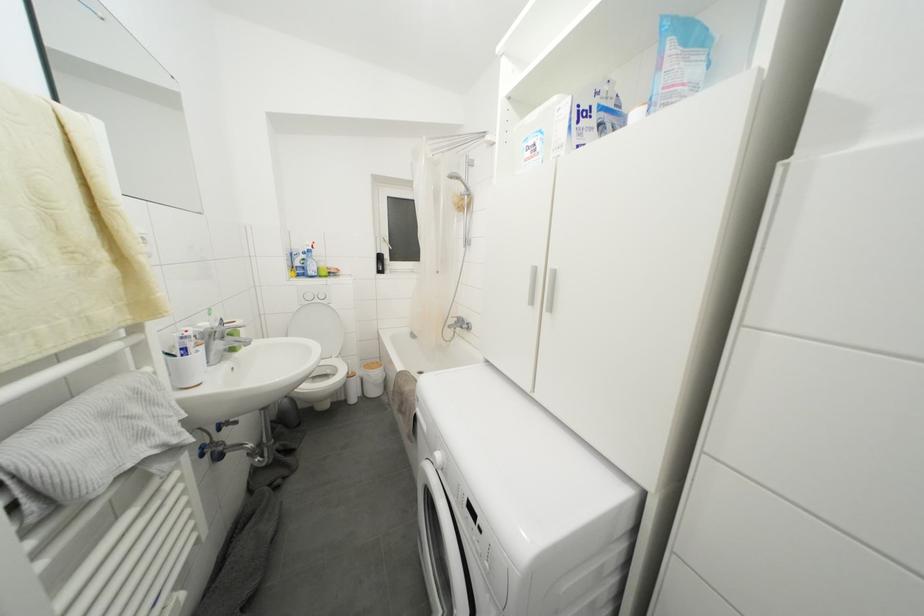
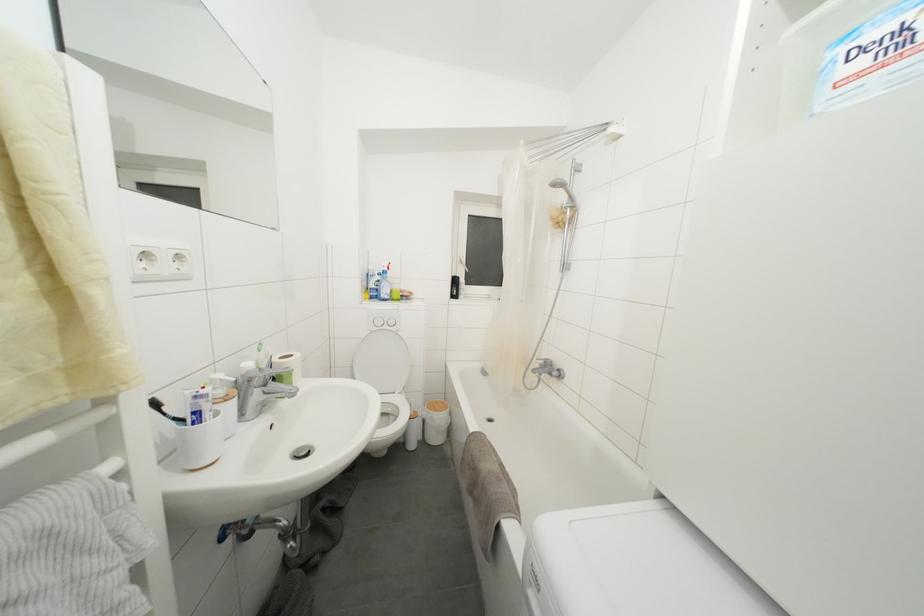
Where in the second image is the point corresponding to (x=306, y=277) from the first image?

(379, 300)